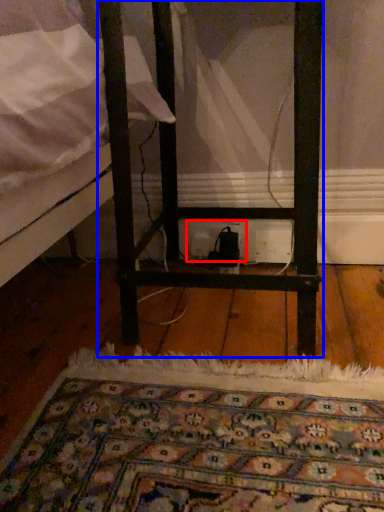
Question: Among these objects, which one is farthest to the camera, electric outlet (highlighted by a red box) or furniture (highlighted by a blue box)?

Choices:
 (A) electric outlet
 (B) furniture

Answer: (A)